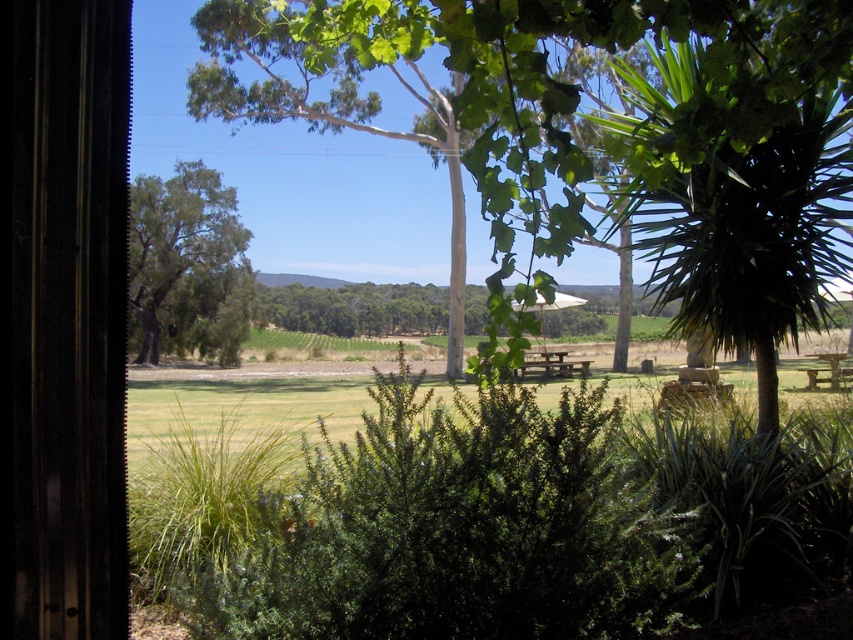
You are planning to set up a picnic blanket between the green leafy tree at center and the wooden picnic table at center. Which object should you place the blanket closer to if you want it to be closer to the tree?

You should place the picnic blanket closer to the green leafy tree at center since it is positioned on the left side of the wooden picnic table at center, making it nearer to the tree.